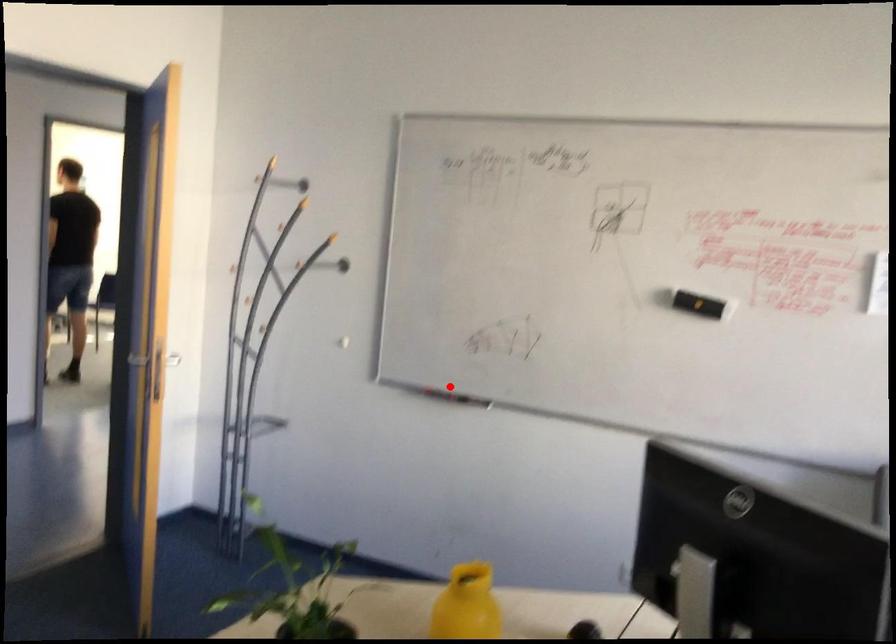
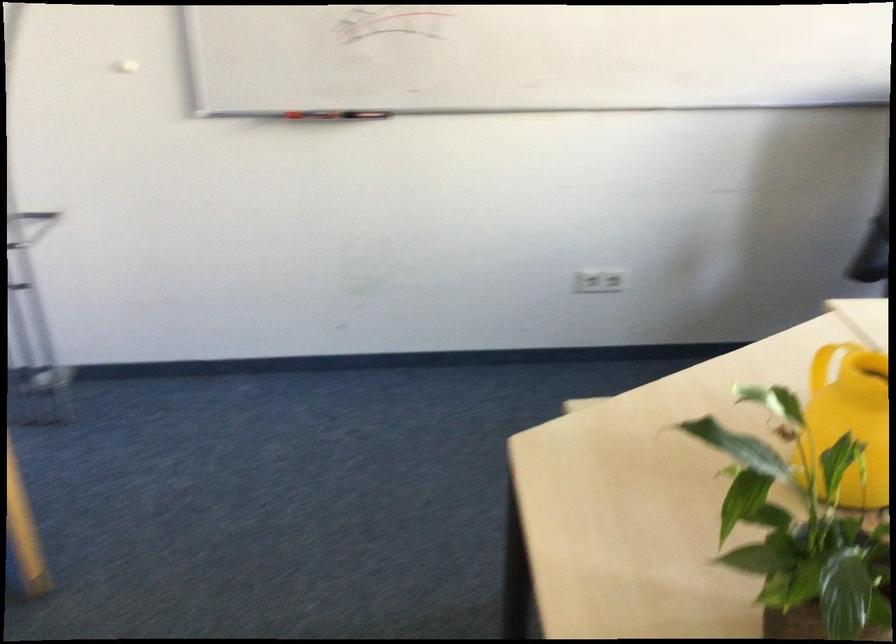
Where in the second image is the point corresponding to the highlighted location from the first image?

(330, 114)